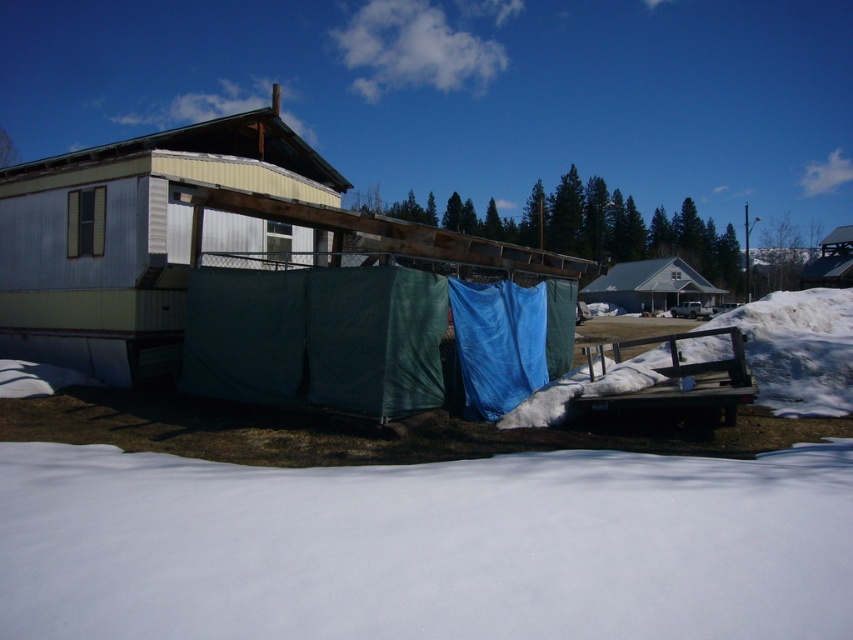
Question: Which point is closer to the camera?

Choices:
 (A) pos(138,248)
 (B) pos(630,260)

Answer: (A)

Question: Which point appears closest to the camera in this image?

Choices:
 (A) (100, 180)
 (B) (613, 296)

Answer: (A)

Question: Can you confirm if metal siding hut at left is thinner than white matte house at center?

Choices:
 (A) no
 (B) yes

Answer: (B)

Question: Is metal siding hut at left positioned behind white matte house at center?

Choices:
 (A) no
 (B) yes

Answer: (A)

Question: Does metal siding hut at left have a larger size compared to white matte house at center?

Choices:
 (A) no
 (B) yes

Answer: (B)